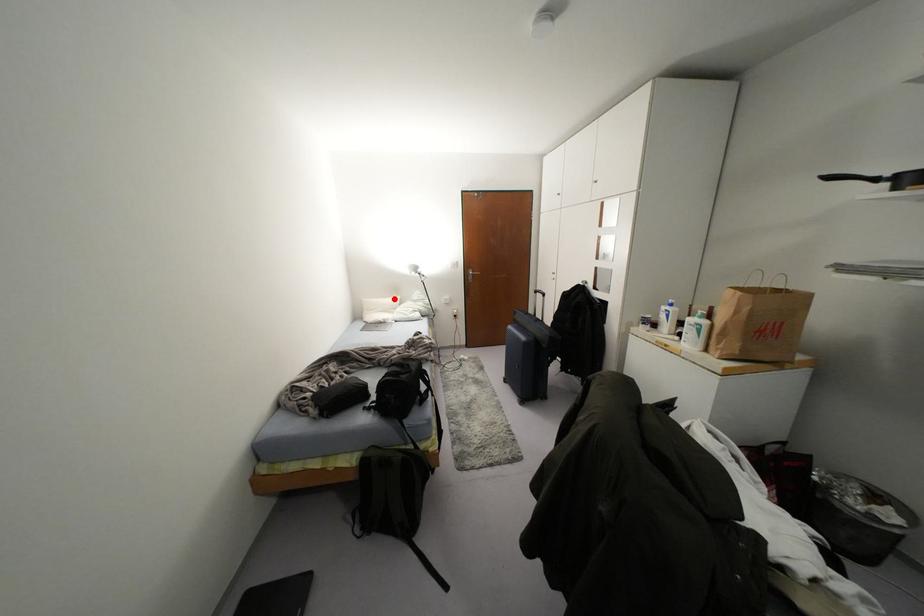
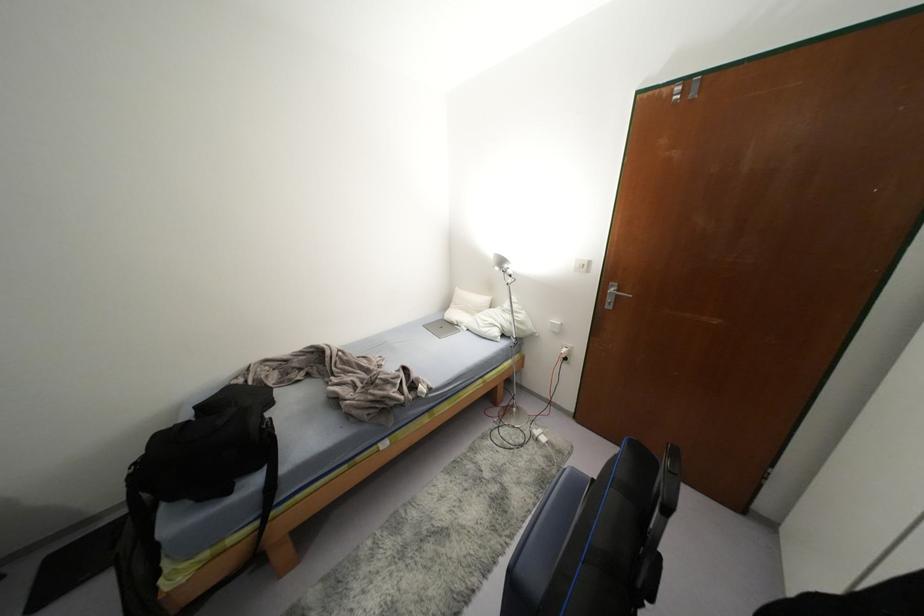
The point at the highlighted location is marked in the first image. Where is the corresponding point in the second image?

(484, 299)